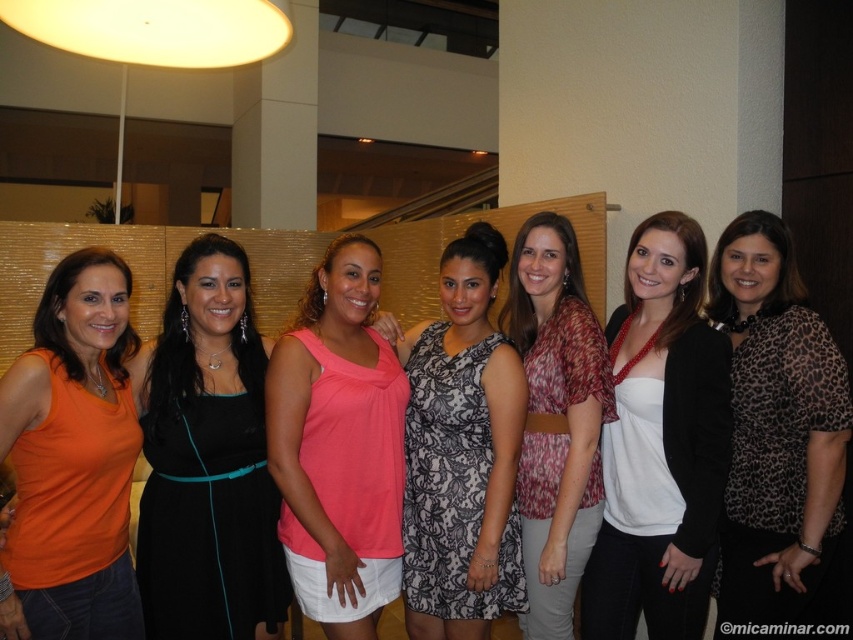
Question: Where is white matte dress at center located in relation to pink fabric tank top at center in the image?

Choices:
 (A) left
 (B) right

Answer: (B)

Question: Is black satin dress at center positioned before printed fabric blouse at center?

Choices:
 (A) no
 (B) yes

Answer: (B)

Question: Which object is closer to the camera taking this photo?

Choices:
 (A) printed fabric blouse at center
 (B) white matte dress at center
 (C) black satin dress at center
 (D) pink fabric tank top at center

Answer: (D)

Question: Which object is positioned farthest from the matte orange tank top at left?

Choices:
 (A) leopard print blouse at center
 (B) black lace dress at center
 (C) printed fabric blouse at center

Answer: (A)

Question: Which is nearer to the black satin dress at center?

Choices:
 (A) black lace dress at center
 (B) pink fabric tank top at center
 (C) matte orange tank top at left

Answer: (C)

Question: Is leopard print blouse at center below black lace dress at center?

Choices:
 (A) no
 (B) yes

Answer: (A)